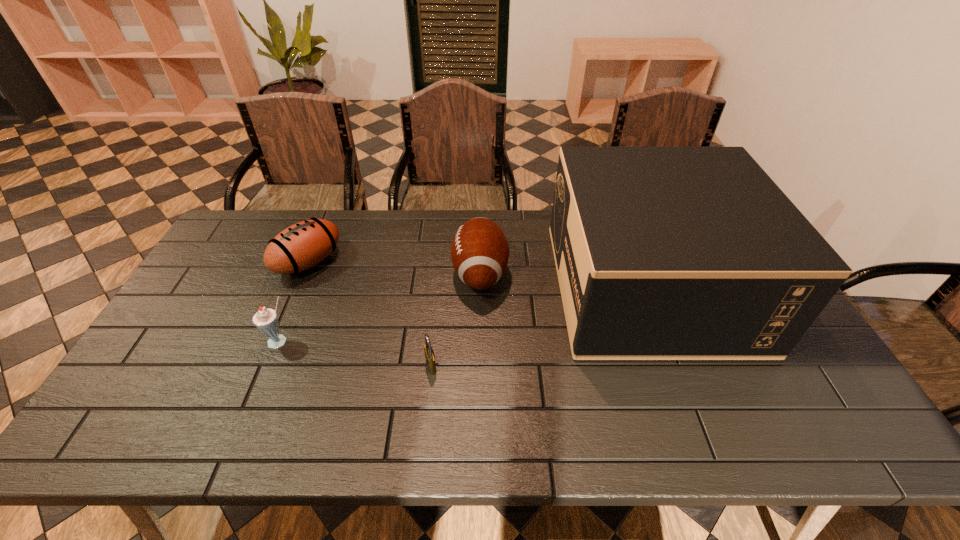
At what (x,y) coordinates should I click in order to perform the action: click on object that is at the far right corner. Please return your answer as a coordinate pair (x, y). The height and width of the screenshot is (540, 960). Looking at the image, I should click on (662, 253).

You are a GUI agent. You are given a task and a screenshot of the screen. Output one action in this format:
    pyautogui.click(x=<x>, y=<y>)
    Task: Click on the vacant space at the far edge of the desktop
    The width and height of the screenshot is (960, 540).
    Given the screenshot: What is the action you would take?
    pyautogui.click(x=412, y=226)

I want to click on free space at the near edge of the desktop, so click(x=266, y=448).

Image resolution: width=960 pixels, height=540 pixels. Find the location of `free region at the left edge`. free region at the left edge is located at coordinates (213, 322).

The width and height of the screenshot is (960, 540). Find the location of `unoccupied area between the fourth object from left to right and the third object from right to left`. unoccupied area between the fourth object from left to right and the third object from right to left is located at coordinates (456, 319).

Identify the location of empty space that is in between the shortest object and the shorter football (American). The width and height of the screenshot is (960, 540). (370, 314).

Locate an element on the screen. The width and height of the screenshot is (960, 540). blank region between the milkshake and the right football (American) is located at coordinates (380, 308).

At what (x,y) coordinates should I click in order to perform the action: click on vacant point located between the right football (American) and the milkshake. Please return your answer as a coordinate pair (x, y). This screenshot has height=540, width=960. Looking at the image, I should click on (380, 308).

This screenshot has width=960, height=540. I want to click on blank region between the shortest object and the rightmost object, so click(540, 326).

Where is `empty space between the milkshake and the third object from right to left`? The height and width of the screenshot is (540, 960). empty space between the milkshake and the third object from right to left is located at coordinates (356, 354).